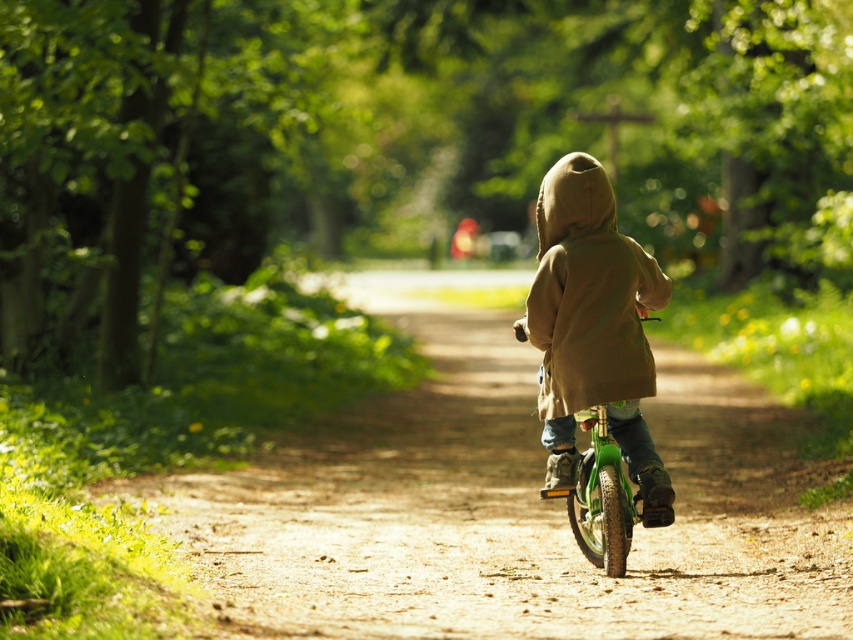
Which is above, camouflage fabric jacket at center or green matte bicycle at center?

camouflage fabric jacket at center is above.

Does camouflage fabric jacket at center have a smaller size compared to green matte bicycle at center?

Incorrect, camouflage fabric jacket at center is not smaller in size than green matte bicycle at center.

Locate an element on the screen. The height and width of the screenshot is (640, 853). camouflage fabric jacket at center is located at coordinates (589, 294).

Where is `camouflage fabric jacket at center`? camouflage fabric jacket at center is located at coordinates (589, 294).